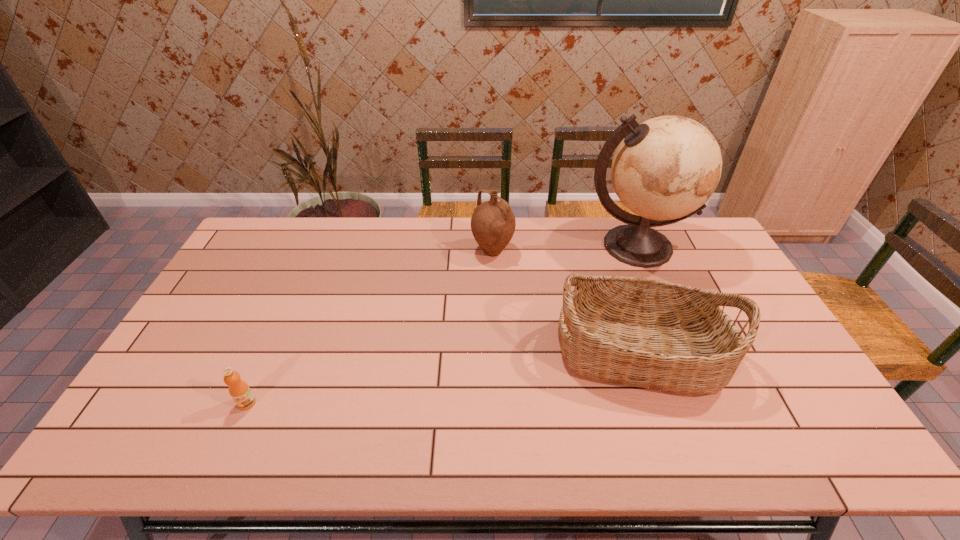
At what (x,y) coordinates should I click in order to perform the action: click on pitcher positioned at the far edge. Please return your answer as a coordinate pair (x, y). Looking at the image, I should click on (493, 223).

Identify the location of object at the right edge. This screenshot has width=960, height=540. (664, 170).

At what (x,y) coordinates should I click in order to perform the action: click on object located at the far right corner. Please return your answer as a coordinate pair (x, y). The width and height of the screenshot is (960, 540). Looking at the image, I should click on (664, 170).

You are a GUI agent. You are given a task and a screenshot of the screen. Output one action in this format:
    pyautogui.click(x=<x>, y=<y>)
    Task: Click on the free space at the far edge of the desktop
    The image size is (960, 540).
    Given the screenshot: What is the action you would take?
    pyautogui.click(x=574, y=219)

What are the coordinates of `vacant space at the near edge` in the screenshot? It's located at (510, 458).

Find the location of `vacant space at the left edge`. vacant space at the left edge is located at coordinates (139, 407).

Where is `vacant space at the right edge of the desktop`? The width and height of the screenshot is (960, 540). vacant space at the right edge of the desktop is located at coordinates (744, 324).

I want to click on vacant space at the far left corner, so (x=276, y=224).

The width and height of the screenshot is (960, 540). I want to click on free point between the third object from right to left and the leftmost object, so click(x=370, y=327).

You are a GUI agent. You are given a task and a screenshot of the screen. Output one action in this format:
    pyautogui.click(x=<x>, y=<y>)
    Task: Click on the vacant space in between the shortest object and the tallest object
    This screenshot has width=960, height=540.
    Given the screenshot: What is the action you would take?
    pyautogui.click(x=442, y=325)